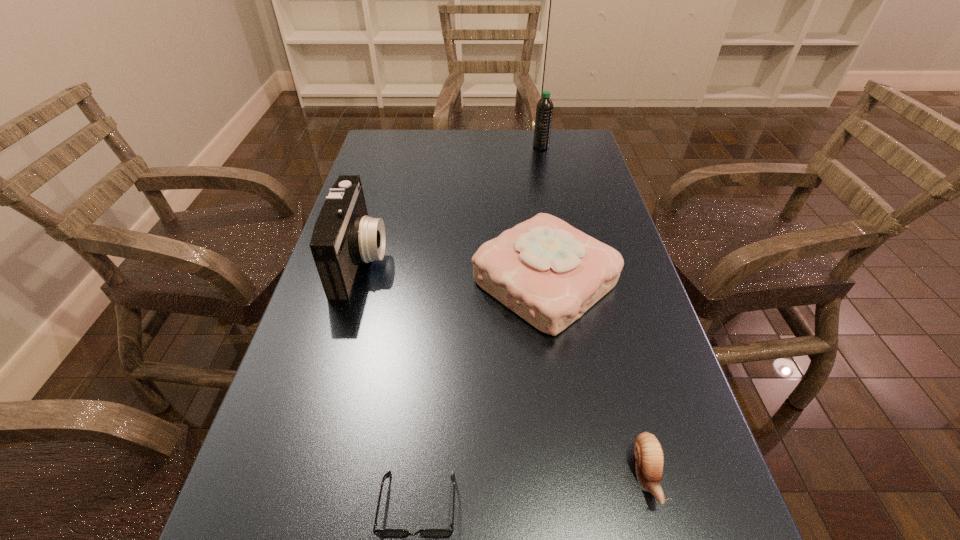
The height and width of the screenshot is (540, 960). What are the coordinates of `vacant space in between the second shortest object and the farthest object` in the screenshot? It's located at (593, 311).

I want to click on free point between the escargot and the third tallest object, so (595, 379).

Identify which object is located as the fourth nearest to the third tallest object. Please provide its 2D coordinates. Your answer should be formatted as a tuple, i.e. [(x, y)], where the tuple contains the x and y coordinates of a point satisfying the conditions above.

[(544, 110)]

The width and height of the screenshot is (960, 540). What are the coordinates of `the fourth closest object to the shortest object` in the screenshot? It's located at (544, 110).

In order to click on free space that satisfies the following two spatial constraints: 1. on the front side of the water bottle; 2. on the lens of the camcorder in this screenshot , I will do `click(564, 260)`.